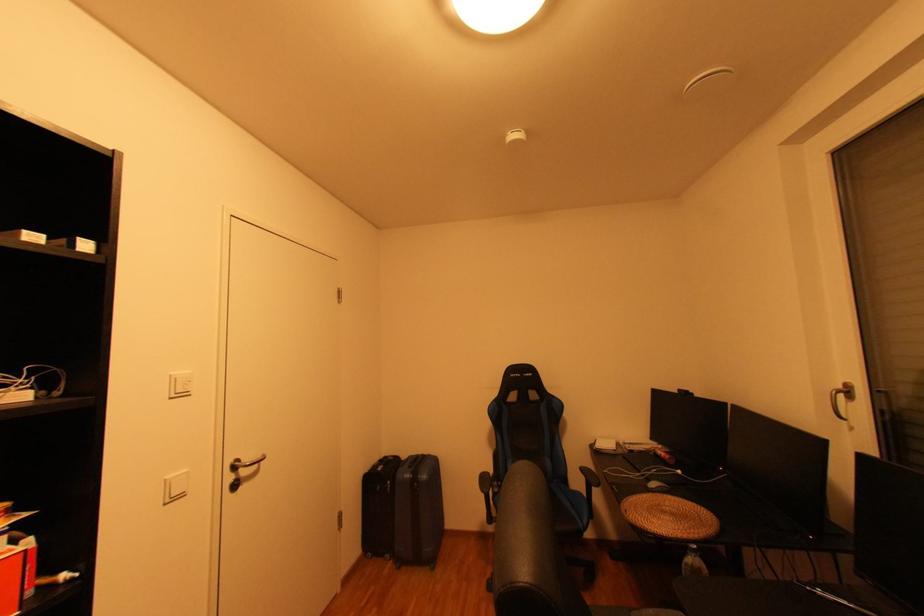
This screenshot has height=616, width=924. What do you see at coordinates (484, 482) in the screenshot?
I see `a chair armrest` at bounding box center [484, 482].